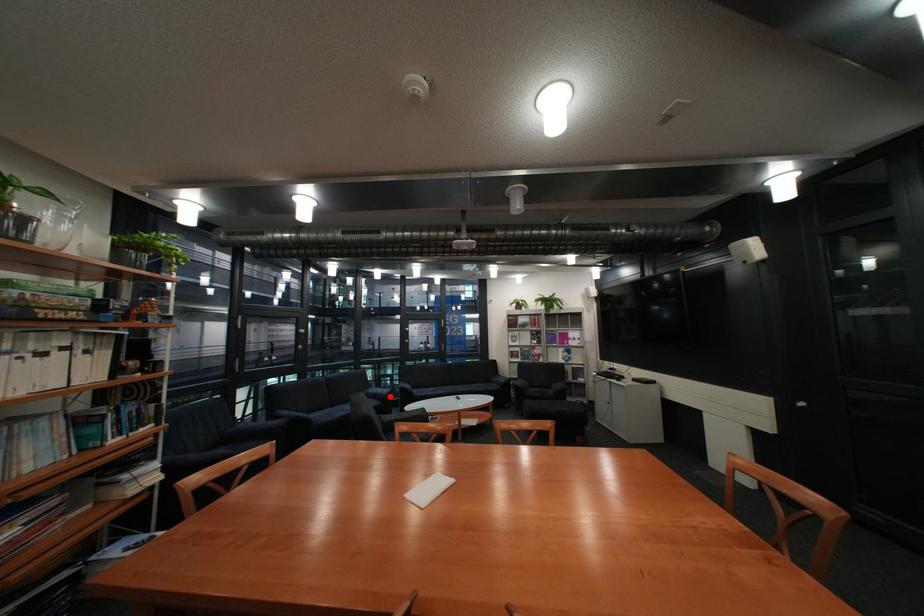
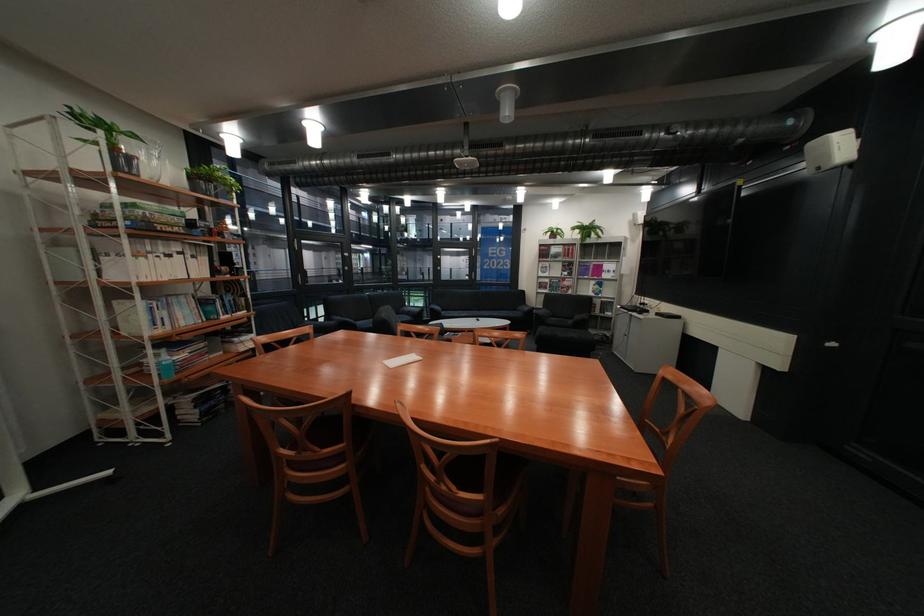
Question: A red point is marked in image1. In image2, is the corresponding 3D point closer to the camera or farther? Reply with the corresponding letter.

Choices:
 (A) The corresponding 3D point is closer.
 (B) The corresponding 3D point is farther.

Answer: (A)